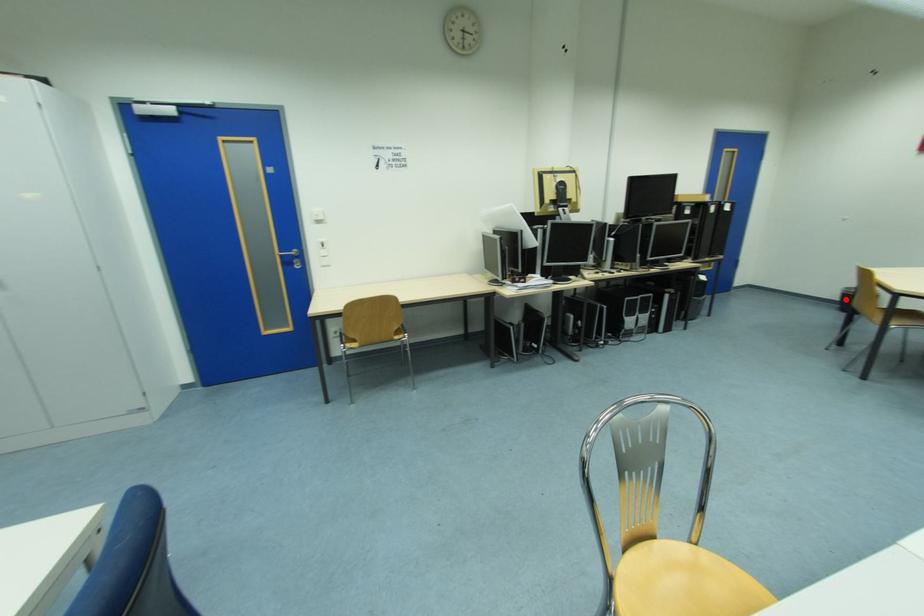
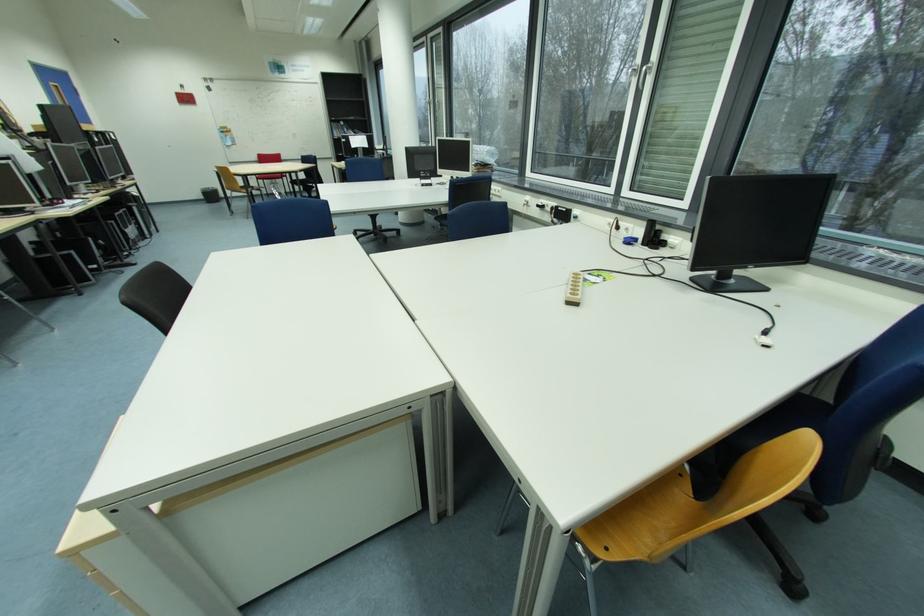
Question: I am providing you with two images of the same scene from different viewpoints. Given a red point in image1, look at the same physical point in image2. Is it:

Choices:
 (A) Closer to the viewpoint
 (B) Farther from the viewpoint

Answer: (A)